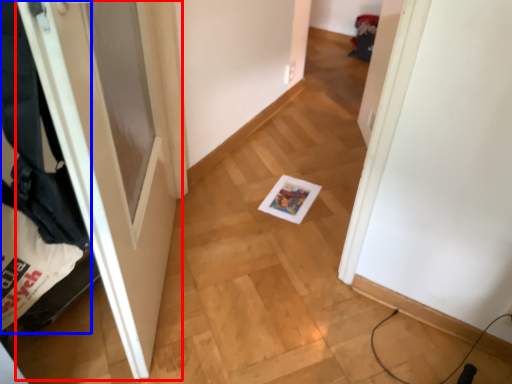
Question: Which of the following is the farthest to the observer, door (highlighted by a red box) or laundry (highlighted by a blue box)?

Choices:
 (A) door
 (B) laundry

Answer: (A)